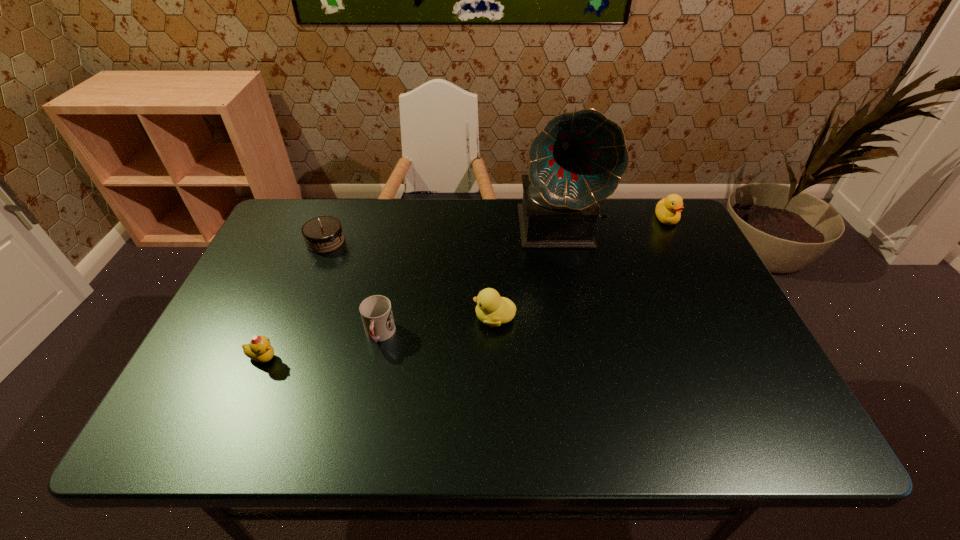
Identify the location of record player. The width and height of the screenshot is (960, 540). (578, 159).

Identify the location of the tallest object. (578, 159).

I want to click on the farthest duckling, so click(668, 210).

The height and width of the screenshot is (540, 960). I want to click on the rightmost object, so click(668, 210).

The image size is (960, 540). In order to click on the second duckling from left to right in this screenshot , I will do `click(491, 309)`.

Find the location of `the second nearest duckling`. the second nearest duckling is located at coordinates (491, 309).

You are a GUI agent. You are given a task and a screenshot of the screen. Output one action in this format:
    pyautogui.click(x=<x>, y=<y>)
    Task: Click on the chocolate cake
    Image resolution: width=960 pixels, height=540 pixels.
    Given the screenshot: What is the action you would take?
    pyautogui.click(x=323, y=234)

Locate an element on the screen. This screenshot has height=540, width=960. the third object from left to right is located at coordinates (376, 312).

Locate an element on the screen. the nearest duckling is located at coordinates (259, 349).

You are a GUI agent. You are given a task and a screenshot of the screen. Output one action in this format:
    pyautogui.click(x=<x>, y=<y>)
    Task: Click on the free space located 0.130m on the horn of the tallest object
    This screenshot has height=540, width=960.
    Given the screenshot: What is the action you would take?
    pyautogui.click(x=573, y=289)